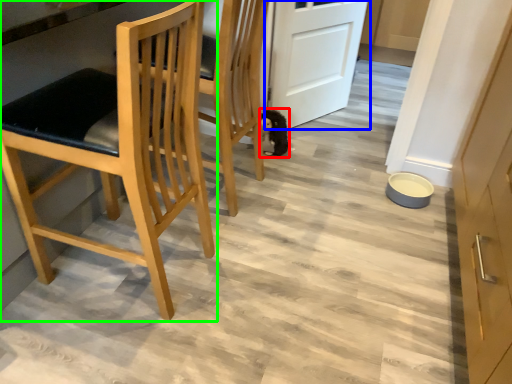
Question: Which object is the farthest from animal (highlighted by a red box)? Choose among these: door (highlighted by a blue box) or chair (highlighted by a green box).

Choices:
 (A) door
 (B) chair

Answer: (B)